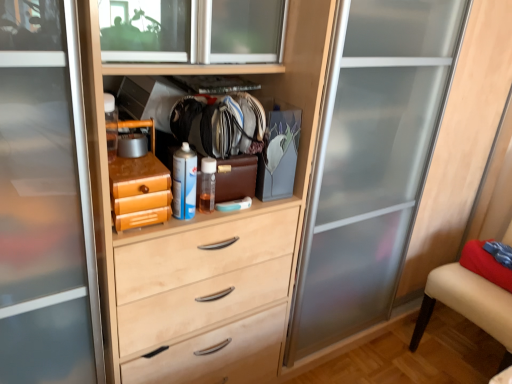
Question: In terms of size, does blue matte spray can at center appear bigger or smaller than beige fabric armchair at right?

Choices:
 (A) small
 (B) big

Answer: (A)

Question: In the image, is blue matte spray can at center positioned in front of or behind beige fabric armchair at right?

Choices:
 (A) behind
 (B) front

Answer: (B)

Question: From the image's perspective, is blue matte spray can at center above or below beige fabric armchair at right?

Choices:
 (A) below
 (B) above

Answer: (B)

Question: Is beige fabric armchair at right spatially inside blue matte spray can at center, or outside of it?

Choices:
 (A) inside
 (B) outside

Answer: (B)

Question: Based on their sizes in the image, would you say beige fabric armchair at right is bigger or smaller than blue matte spray can at center?

Choices:
 (A) small
 (B) big

Answer: (B)

Question: Is beige fabric armchair at right in front of or behind blue matte spray can at center in the image?

Choices:
 (A) behind
 (B) front

Answer: (A)

Question: From a real-world perspective, is beige fabric armchair at right physically located above or below blue matte spray can at center?

Choices:
 (A) below
 (B) above

Answer: (A)